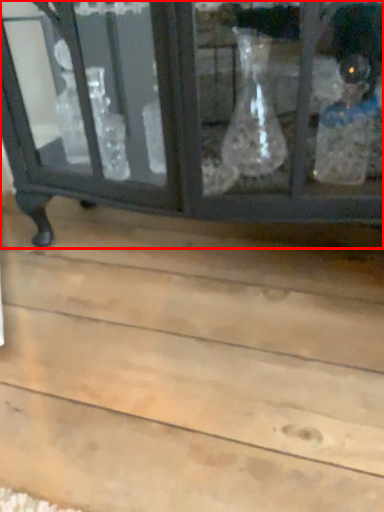
Question: Considering the relative positions of furniture (annotated by the red box) and plank in the image provided, where is furniture (annotated by the red box) located with respect to the staircase?

Choices:
 (A) left
 (B) right

Answer: (B)